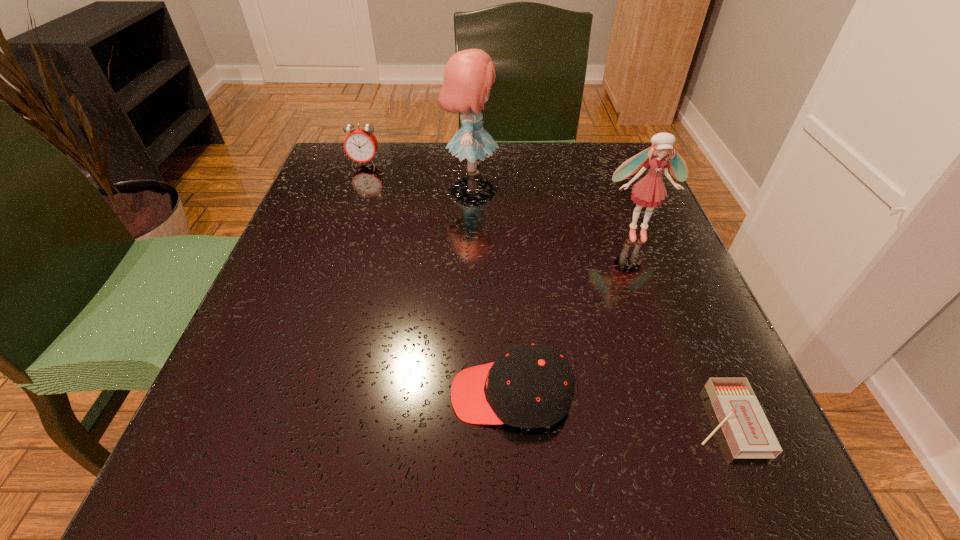
Identify the location of the taller doll. (469, 74).

I want to click on the farther doll, so click(x=469, y=74).

Locate an element on the screen. The height and width of the screenshot is (540, 960). the right doll is located at coordinates (650, 191).

Locate an element on the screen. This screenshot has width=960, height=540. the fourth shortest object is located at coordinates (650, 191).

Locate an element on the screen. This screenshot has width=960, height=540. the third shortest object is located at coordinates tap(360, 145).

You are a GUI agent. You are given a task and a screenshot of the screen. Output one action in this format:
    pyautogui.click(x=<x>, y=<y>)
    Task: Click on the leftmost object
    
    Given the screenshot: What is the action you would take?
    pyautogui.click(x=360, y=145)

The image size is (960, 540). I want to click on the fourth tallest object, so click(528, 386).

Find the location of a particular element. the shortest object is located at coordinates (748, 433).

Locate an element on the screen. The width and height of the screenshot is (960, 540). vacant area situated on the front-facing side of the tallest object is located at coordinates (551, 170).

Locate an element on the screen. free space located on the front-facing side of the shorter doll is located at coordinates (663, 304).